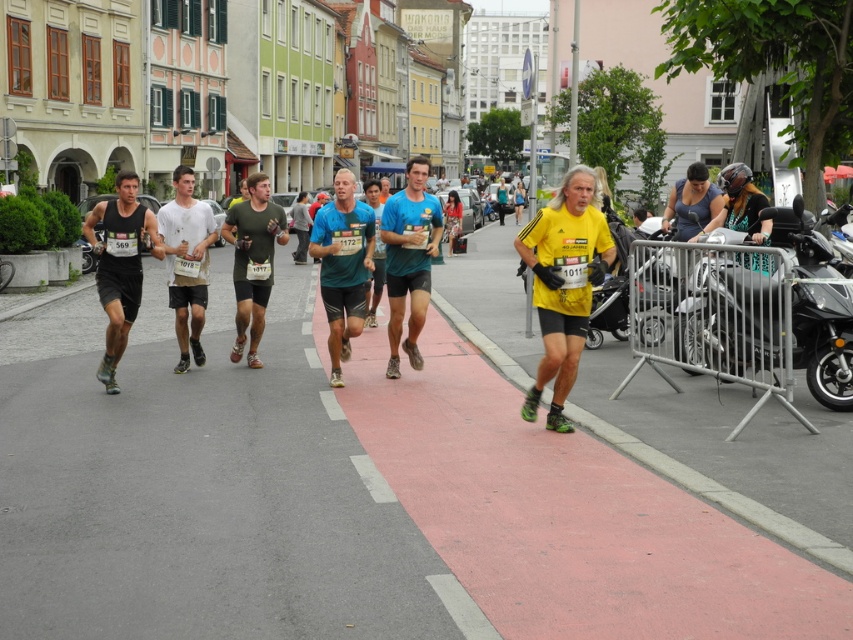
You are a photographer standing at the starting line of a street race. You want to capture a clear photo of the yellow matte shirt at center as they approach the finish line. If your camera has a minimum focus distance of 5 meters, will you be able to take the photo without moving?

The yellow matte shirt at center is 7.11 meters away from the camera, which is beyond the minimum focus distance of 5 meters. Therefore, the photographer can take a clear photo without moving.